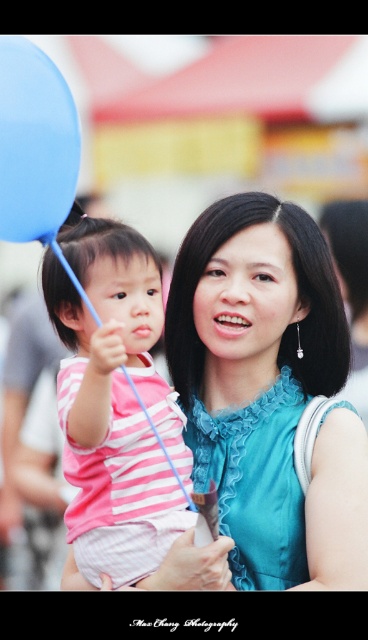
Locate an element on the screen. pink striped shirt at left is located at coordinates (111, 371).

Does point (76, 230) come in front of point (36, 154)?

That is False.

Find the location of a particular element. The height and width of the screenshot is (640, 368). pink striped shirt at left is located at coordinates (111, 371).

Who is more forward, [269,570] or [33,81]?

Point [33,81] is more forward.

Does point (284, 467) come behind point (44, 156)?

That is True.

You are a GUI agent. You are given a task and a screenshot of the screen. Output one action in this format:
    pyautogui.click(x=<x>, y=<y>)
    Task: Click on the blue satin dress at center
    The height and width of the screenshot is (640, 368).
    Given the screenshot: What is the action you would take?
    pyautogui.click(x=267, y=390)

Is blue satin dress at center to the left of pink striped shirt at left from the viewer's perspective?

In fact, blue satin dress at center is to the right of pink striped shirt at left.

Is blue satin dress at center closer to the viewer compared to pink striped shirt at left?

No.

Is point (309, 321) in front of point (83, 320)?

That is False.

Identify the location of blue satin dress at center. (267, 390).